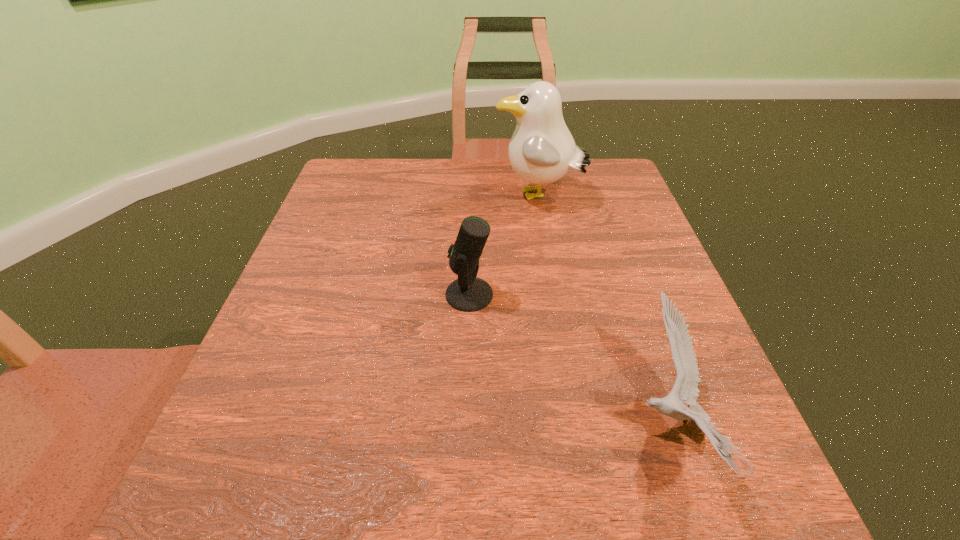
Locate an element on the screen. This screenshot has width=960, height=540. vacant region located 0.260m at the tip of the beak of the nearer gull is located at coordinates (459, 427).

This screenshot has height=540, width=960. What are the coordinates of `vacant space situated at the tip of the beak of the nearer gull` in the screenshot? It's located at (367, 427).

Identify the location of blank space located at the tip of the beak of the nearer gull. Image resolution: width=960 pixels, height=540 pixels. [367, 427].

Identify the location of object present at the far edge. (542, 150).

Locate an element on the screen. This screenshot has width=960, height=540. object positioned at the near edge is located at coordinates (685, 390).

Locate an element on the screen. The image size is (960, 540). object located at the far right corner is located at coordinates (542, 150).

Identify the location of object that is at the near right corner. This screenshot has height=540, width=960. (685, 390).

Find the location of a particular element. This screenshot has width=960, height=540. vacant space at the far edge is located at coordinates (510, 174).

The height and width of the screenshot is (540, 960). Find the location of `free space at the near edge`. free space at the near edge is located at coordinates (636, 536).

You are a GUI agent. You are given a task and a screenshot of the screen. Output one action in this format:
    pyautogui.click(x=<x>, y=<y>)
    Task: Click on the vacant space at the left edge of the desktop
    The image size is (960, 540).
    Given the screenshot: What is the action you would take?
    pyautogui.click(x=346, y=275)